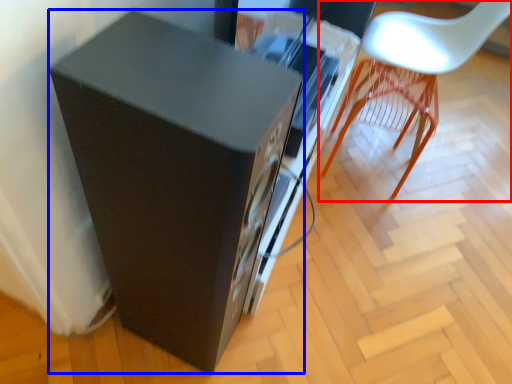
Question: Among these objects, which one is nearest to the camera, chair (highlighted by a red box) or furniture (highlighted by a blue box)?

Choices:
 (A) chair
 (B) furniture

Answer: (B)